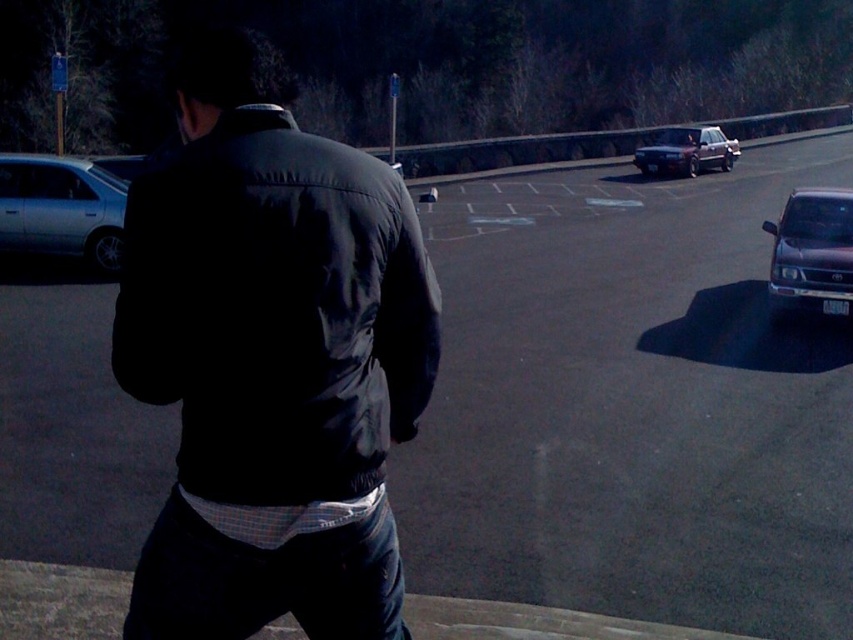
Question: Is silver metallic sedan at left bigger than matte black sedan at upper right?

Choices:
 (A) yes
 (B) no

Answer: (B)

Question: Considering the real-world distances, which object is closest to the silver metallic sedan at left?

Choices:
 (A) shiny dark gray suv at right
 (B) matte black sedan at upper right

Answer: (A)

Question: Does silver metallic sedan at left have a larger size compared to matte black sedan at upper right?

Choices:
 (A) no
 (B) yes

Answer: (A)

Question: Is shiny dark gray suv at right behind matte black sedan at upper right?

Choices:
 (A) yes
 (B) no

Answer: (B)

Question: Which point is farther to the camera?

Choices:
 (A) shiny dark gray suv at right
 (B) matte black jacket at center
 (C) matte black sedan at upper right
 (D) silver metallic sedan at left

Answer: (C)

Question: Which of the following is the closest to the observer?

Choices:
 (A) matte black jacket at center
 (B) shiny dark gray suv at right

Answer: (A)